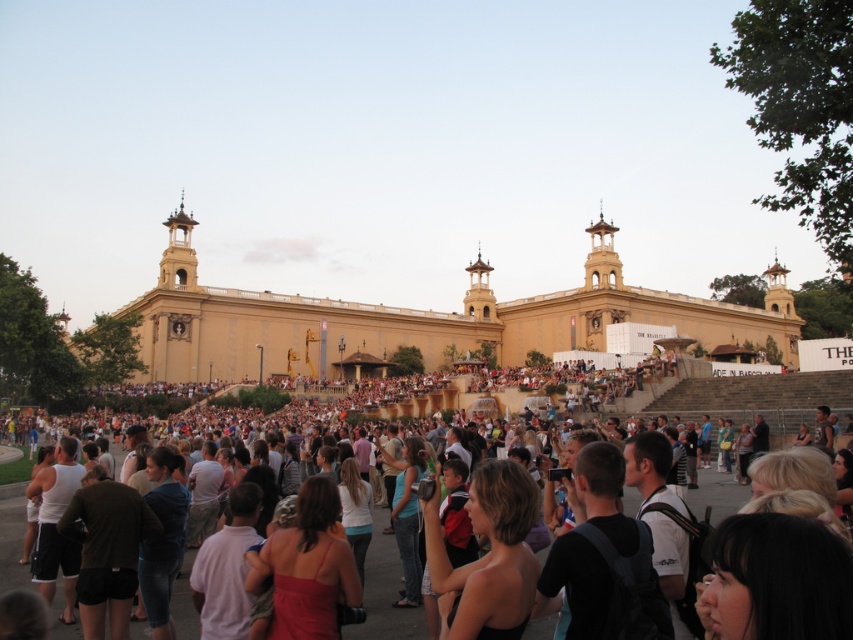
You are standing at the point marked by point (419, 320). What is the name of the building you are facing?

The point (419, 320) marks the golden stone church at center, so the building you are facing is the golden stone church at center.

You are a photographer at the event and want to capture a photo that includes both the golden stone church at center and the light brown hair at lower center. Based on their positions, which object should be placed on the right side of your photo?

The golden stone church at center should be placed on the right side of your photo because it is positioned on the right side of the light brown hair at lower center according to the description.

You are a photographer at the event and want to take a photo of the golden stone church at center and the light brown hair at lower center. Which one should you focus on first if you want to capture both in a single frame without moving the camera?

The golden stone church at center is taller than the light brown hair at lower center, so you should focus on the golden stone church at center first to ensure it is fully in frame before adjusting for the light brown hair at lower center.